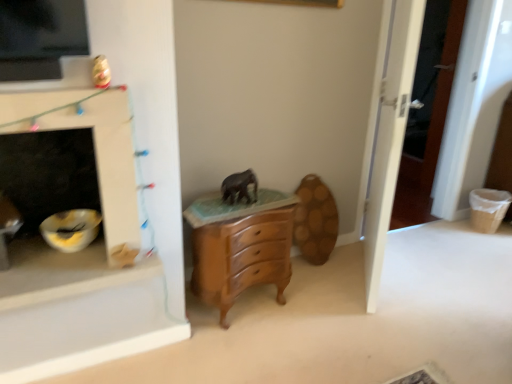
Question: From a real-world perspective, is white glossy fireplace at left on matte gray elephant at center?

Choices:
 (A) yes
 (B) no

Answer: (A)

Question: Is white glossy fireplace at left at the right side of matte gray elephant at center?

Choices:
 (A) yes
 (B) no

Answer: (B)

Question: Can you confirm if white glossy fireplace at left is positioned to the left of matte gray elephant at center?

Choices:
 (A) no
 (B) yes

Answer: (B)

Question: From the image's perspective, is white glossy fireplace at left under matte gray elephant at center?

Choices:
 (A) yes
 (B) no

Answer: (A)

Question: From the image's perspective, is white glossy fireplace at left on top of matte gray elephant at center?

Choices:
 (A) yes
 (B) no

Answer: (B)

Question: Is matte gray elephant at center to the left or to the right of white glossy fireplace at left in the image?

Choices:
 (A) left
 (B) right

Answer: (B)

Question: Is matte gray elephant at center spatially inside white glossy fireplace at left, or outside of it?

Choices:
 (A) inside
 (B) outside

Answer: (B)

Question: Is matte gray elephant at center wider or thinner than white glossy fireplace at left?

Choices:
 (A) thin
 (B) wide

Answer: (B)

Question: Is matte gray elephant at center taller or shorter than white glossy fireplace at left?

Choices:
 (A) short
 (B) tall

Answer: (A)

Question: Considering the positions of point (390, 132) and point (248, 198), is point (390, 132) closer or farther from the camera than point (248, 198)?

Choices:
 (A) closer
 (B) farther

Answer: (B)

Question: Would you say white wooden door at right is to the left or to the right of matte gray elephant at center in the picture?

Choices:
 (A) left
 (B) right

Answer: (B)

Question: Is white wooden door at right spatially inside matte gray elephant at center, or outside of it?

Choices:
 (A) inside
 (B) outside

Answer: (B)

Question: Is white wooden door at right taller or shorter than matte gray elephant at center?

Choices:
 (A) tall
 (B) short

Answer: (A)

Question: Is matte gray elephant at center wider or thinner than wooden chest of drawers at center?

Choices:
 (A) thin
 (B) wide

Answer: (A)

Question: In terms of height, does matte gray elephant at center look taller or shorter compared to wooden chest of drawers at center?

Choices:
 (A) short
 (B) tall

Answer: (A)